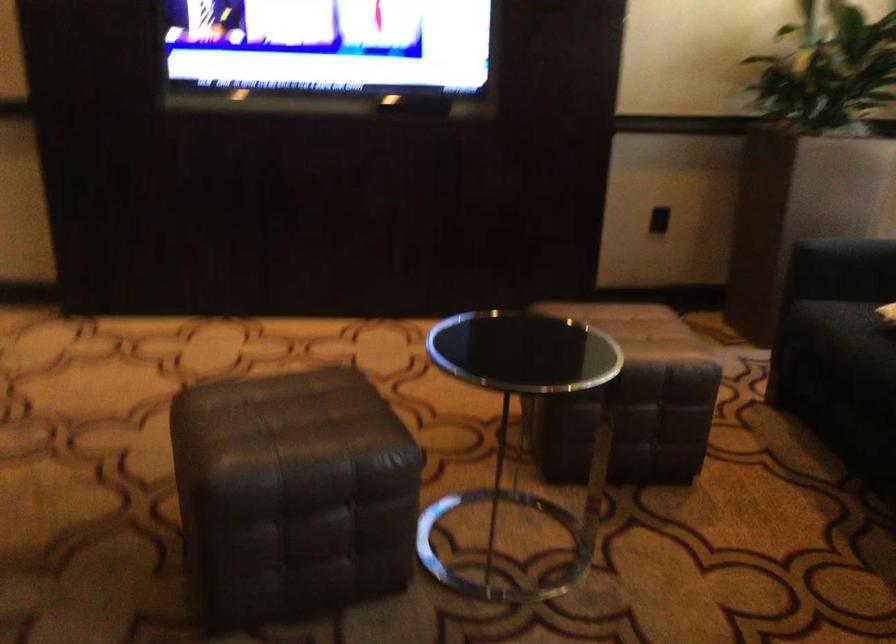
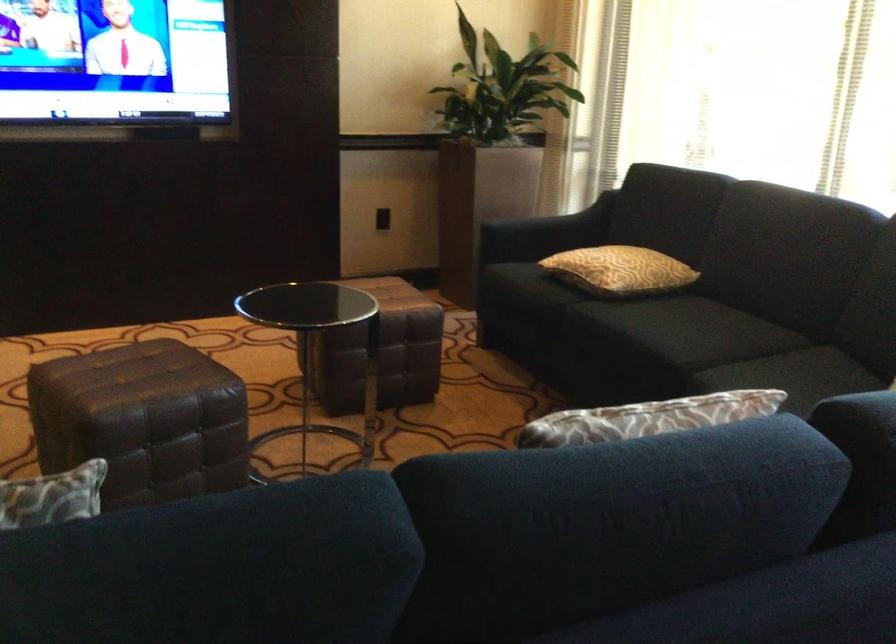
Question: The camera is either moving clockwise (left) or counter-clockwise (right) around the object. The first image is from the beginning of the video and the second image is from the end. Is the camera moving left or right when shooting the video?

Choices:
 (A) Left
 (B) Right

Answer: (A)